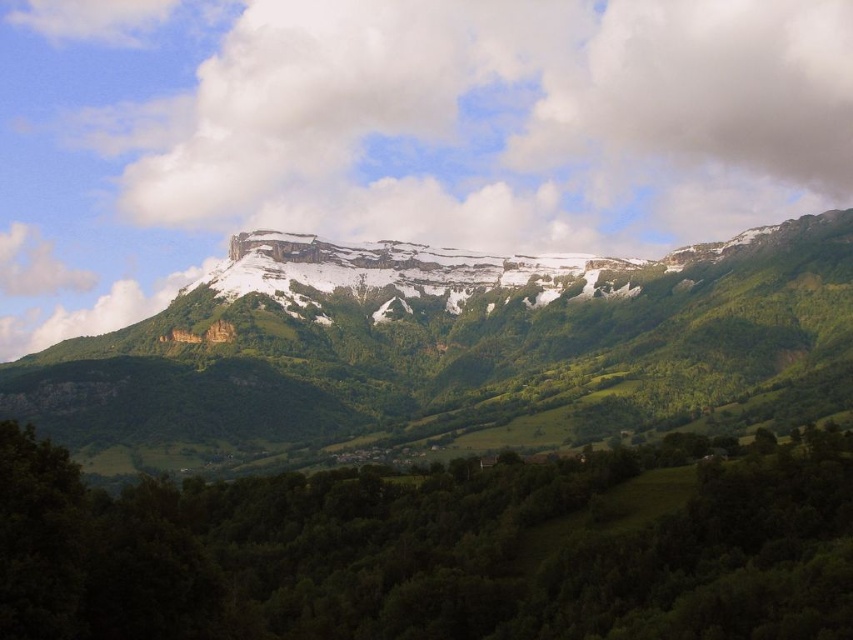
You are a photographer planning to capture the mountain landscape. You want to ensure that the white fluffy cloud at upper center and the green leafy trees at lower center are both in the frame. Based on their sizes, which object should you focus on to ensure both fit in the composition?

The white fluffy cloud at upper center is larger in width than the green leafy trees at lower center. To ensure both fit in the composition, focus on framing the larger object first, which is the white fluffy cloud at upper center, as it requires more space.

You are an airplane pilot flying over the mountainous landscape. You notice a point at coordinates [524,120]. What object is located at that point?

The point at coordinates [524,120] indicates a white fluffy cloud at upper center.

You are a hiker standing at the base of the mountain. You see the white fluffy cloud at upper center and the green leafy trees at lower center. Which object is farther away from you?

The white fluffy cloud at upper center is farther away from you than the green leafy trees at lower center because it is 648.46 feet away from the trees.